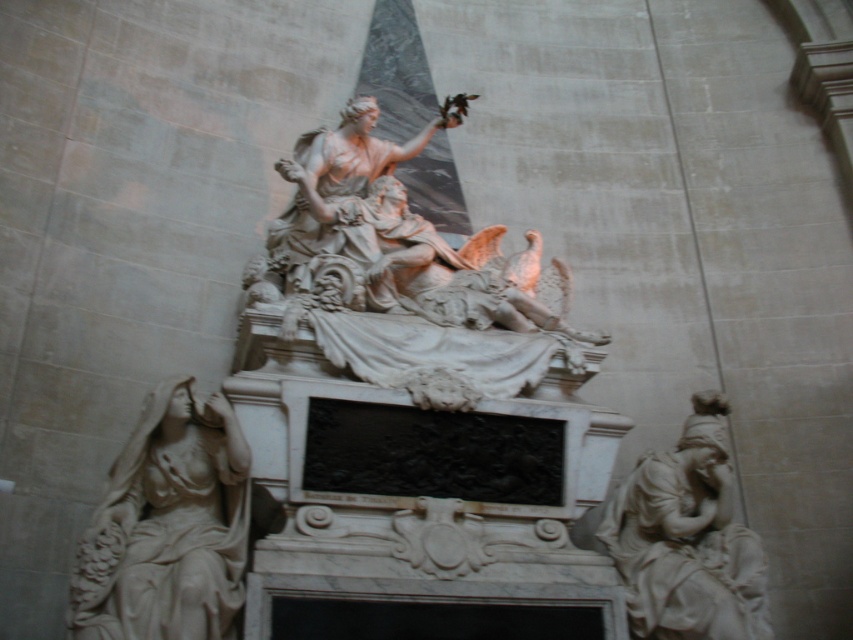
Question: Can you confirm if white marble statue at left is bigger than white marble statue at lower right?

Choices:
 (A) yes
 (B) no

Answer: (A)

Question: Is white marble statue at center to the left of white marble statue at left from the viewer's perspective?

Choices:
 (A) yes
 (B) no

Answer: (B)

Question: Does white marble statue at center have a larger size compared to white marble statue at left?

Choices:
 (A) yes
 (B) no

Answer: (A)

Question: Which object is farther from the camera taking this photo?

Choices:
 (A) white marble statue at left
 (B) white marble statue at center
 (C) white marble statue at lower right

Answer: (B)

Question: Among these objects, which one is nearest to the camera?

Choices:
 (A) white marble statue at center
 (B) white marble statue at lower right

Answer: (B)

Question: Among these points, which one is farthest from the camera?

Choices:
 (A) (184, 500)
 (B) (294, 179)

Answer: (B)